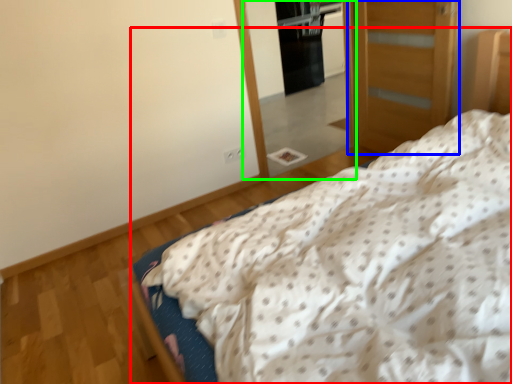
Question: Based on their relative distances, which object is farther from bed (highlighted by a red box)? Choose from door (highlighted by a blue box) and mirror (highlighted by a green box).

Choices:
 (A) door
 (B) mirror

Answer: (B)